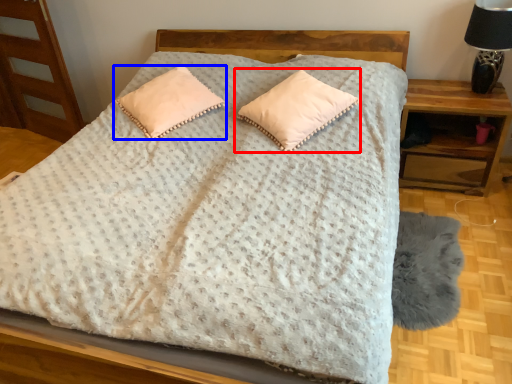
Question: Which object appears closest to the camera in this image, pillow (highlighted by a red box) or pillow (highlighted by a blue box)?

Choices:
 (A) pillow
 (B) pillow

Answer: (A)